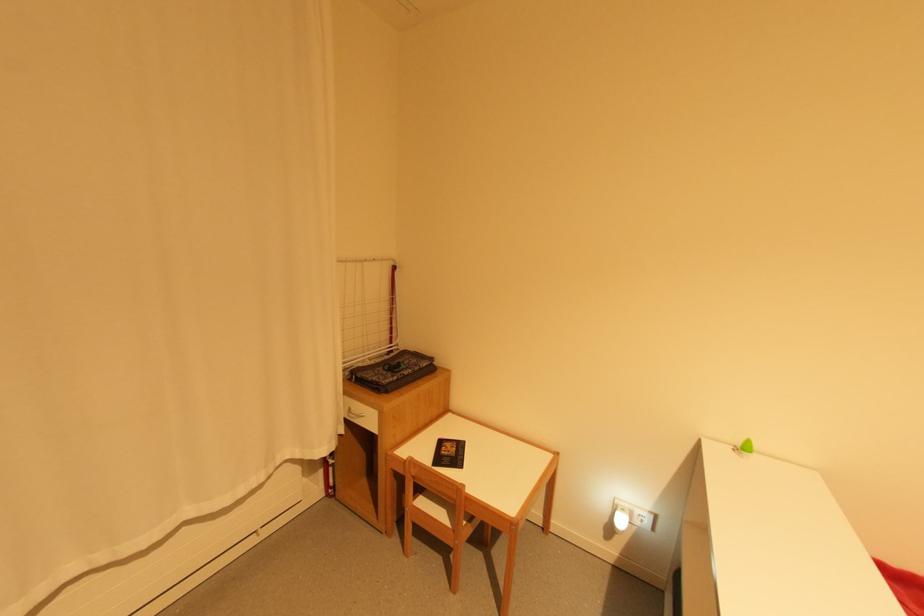
Which object does [621,520] point to?

It corresponds to the white night light in the image.